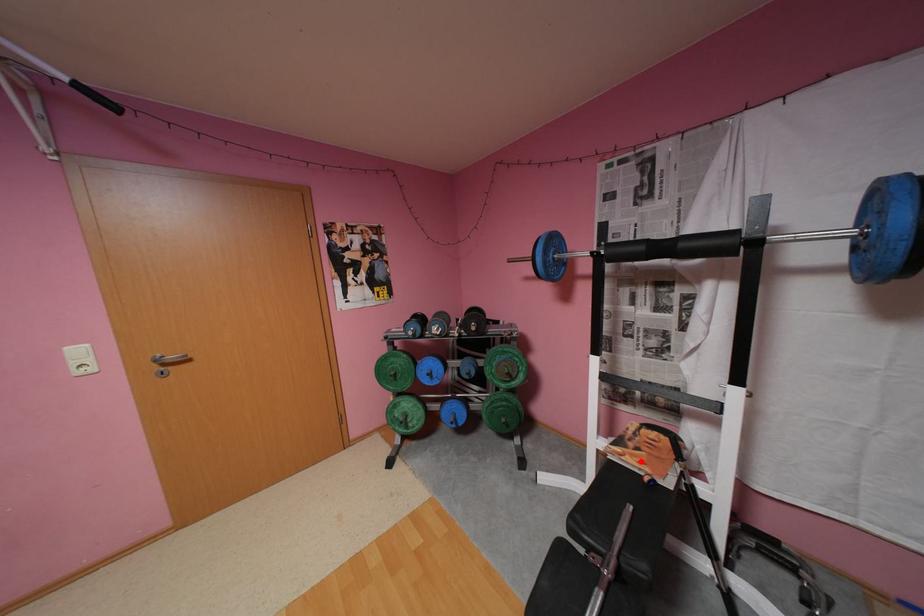
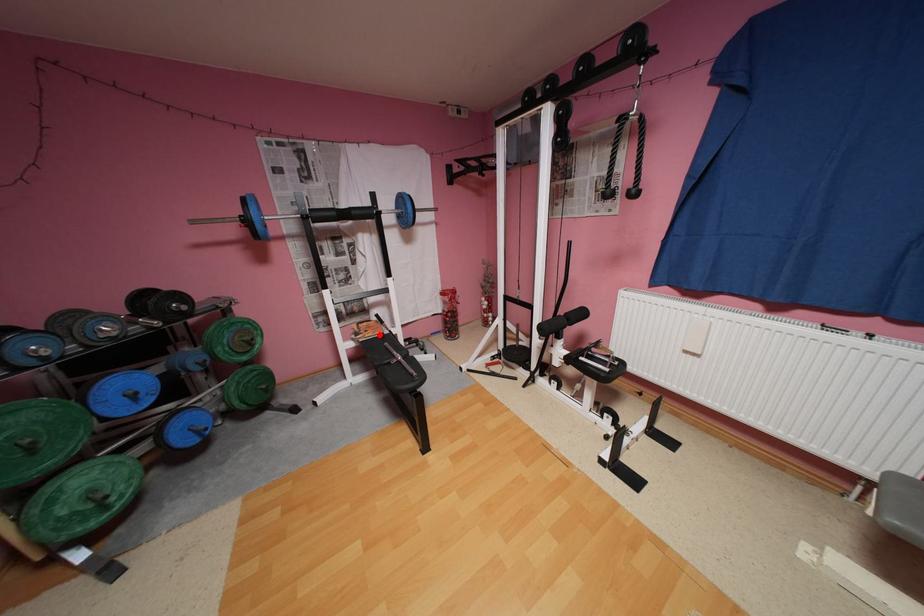
I am providing you with two images of the same scene from different viewpoints. A red point is marked on the first image and another point is marked on the second image. Is the marked point in image1 the same physical position as the marked point in image2?

Yes